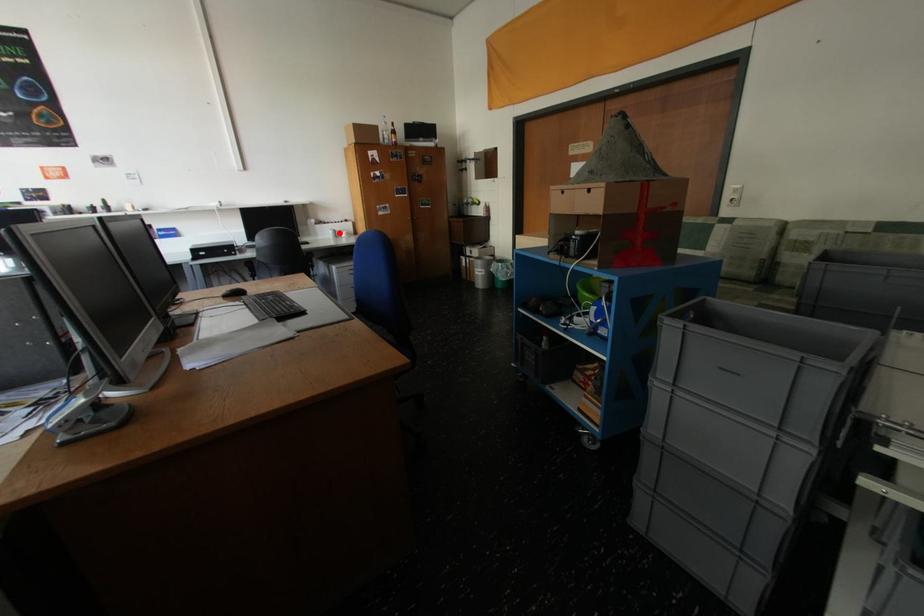
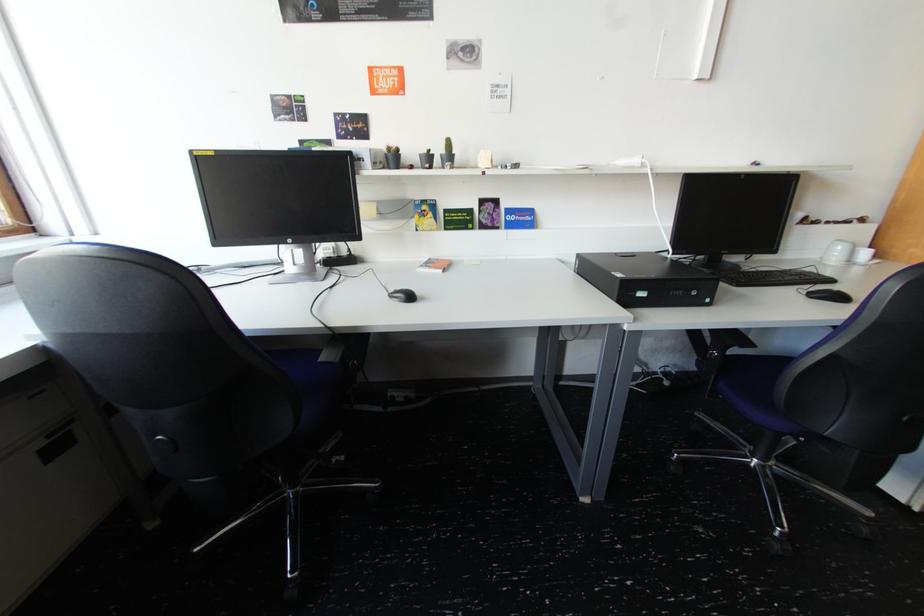
Question: I am providing you with two images of the same scene from different viewpoints. A red point is marked on the first image. Is the red point's position out of view in image 2?

Choices:
 (A) Yes
 (B) No

Answer: (B)